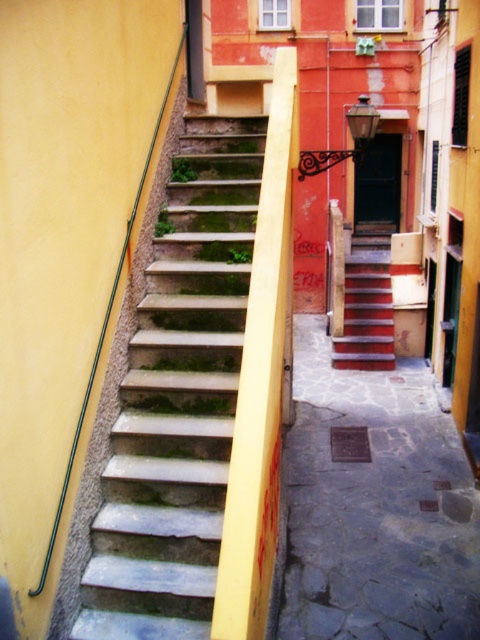
Question: Can you confirm if stone steps at left is positioned to the right of wooden stairs at center?

Choices:
 (A) no
 (B) yes

Answer: (A)

Question: Which object is farther from the camera taking this photo?

Choices:
 (A) wooden stairs at center
 (B) smooth stone alley at center

Answer: (A)

Question: Observing the image, what is the correct spatial positioning of stone steps at left in reference to wooden stairs at center?

Choices:
 (A) above
 (B) below

Answer: (B)

Question: Is smooth stone alley at center bigger than wooden stairs at center?

Choices:
 (A) yes
 (B) no

Answer: (B)

Question: Which object is farther from the camera taking this photo?

Choices:
 (A) wooden stairs at center
 (B) stone steps at left

Answer: (A)

Question: Based on their relative distances, which object is farther from the wooden stairs at center?

Choices:
 (A) smooth stone alley at center
 (B) stone steps at left

Answer: (B)